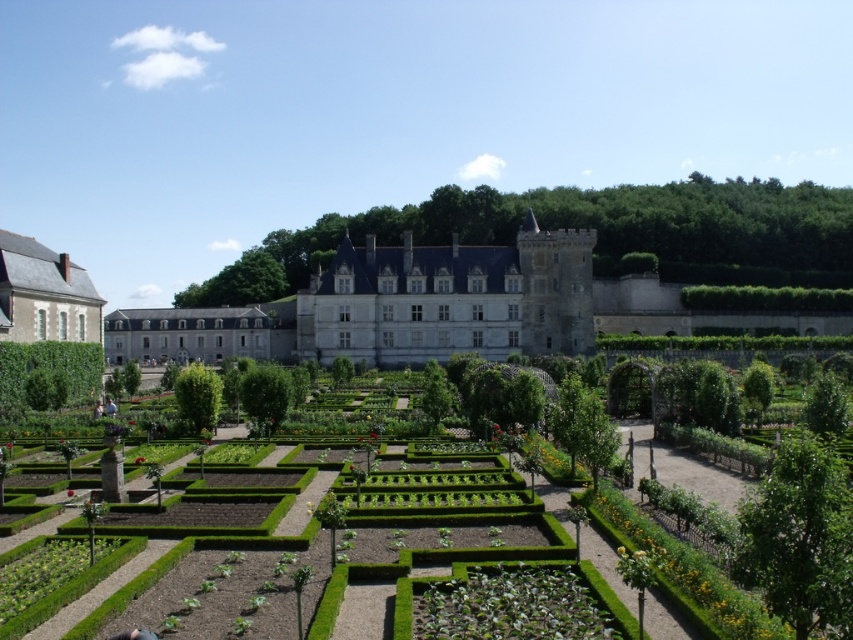
Question: Considering the relative positions of green leafy hedge at lower left and green leafy hedge at right in the image provided, where is green leafy hedge at lower left located with respect to green leafy hedge at right?

Choices:
 (A) right
 (B) left

Answer: (B)

Question: Which point appears closest to the camera in this image?

Choices:
 (A) (26, 304)
 (B) (10, 387)
 (C) (705, 308)

Answer: (B)

Question: Is green grassy bed at center to the left of light gray stone building at left from the viewer's perspective?

Choices:
 (A) no
 (B) yes

Answer: (A)

Question: Among these objects, which one is farthest from the camera?

Choices:
 (A) green leafy hedge at center
 (B) green leafy hedge at lower left
 (C) green grassy bed at center
 (D) light gray stone building at left

Answer: (A)

Question: Is green leafy hedge at lower left to the right of green leafy hedge at right from the viewer's perspective?

Choices:
 (A) yes
 (B) no

Answer: (B)

Question: Which of these objects is positioned closest to the green leafy hedge at lower left?

Choices:
 (A) green grassy bed at center
 (B) green leafy hedge at right
 (C) green leafy hedge at center
 (D) light gray stone building at left

Answer: (D)